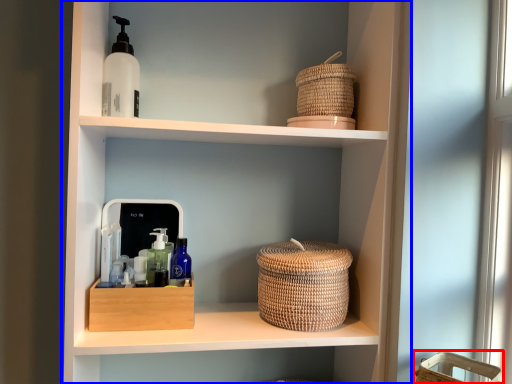
Question: Among these objects, which one is nearest to the camera, basket (highlighted by a red box) or shelf (highlighted by a blue box)?

Choices:
 (A) basket
 (B) shelf

Answer: (A)